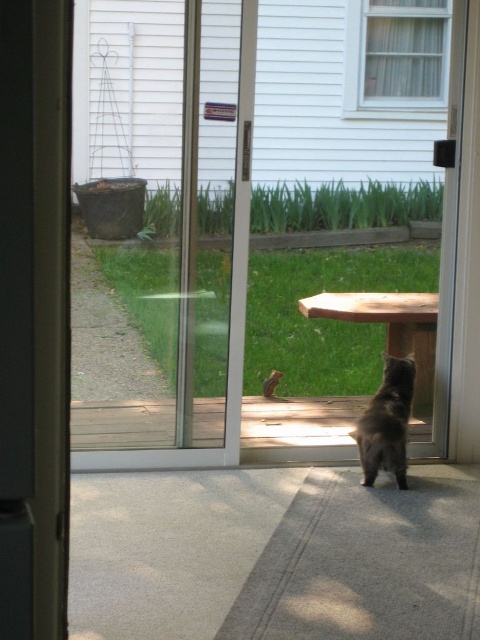
Question: Among these points, which one is farthest from the camera?

Choices:
 (A) (243, 29)
 (B) (397, 486)

Answer: (B)

Question: Which point is closer to the camera taking this photo?

Choices:
 (A) (377, 410)
 (B) (192, 449)

Answer: (A)

Question: Is transparent glass screen door at center positioned behind dark gray fur cat at center?

Choices:
 (A) no
 (B) yes

Answer: (A)

Question: Is transparent glass screen door at center smaller than dark gray fur cat at center?

Choices:
 (A) no
 (B) yes

Answer: (A)

Question: Does transparent glass screen door at center have a lesser width compared to dark gray fur cat at center?

Choices:
 (A) no
 (B) yes

Answer: (A)

Question: Which point is farther to the camera?

Choices:
 (A) transparent glass screen door at center
 (B) dark gray fur cat at center

Answer: (B)